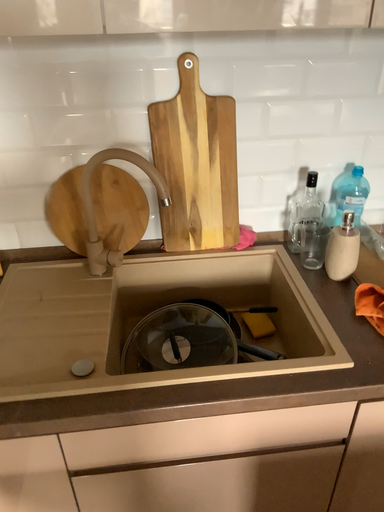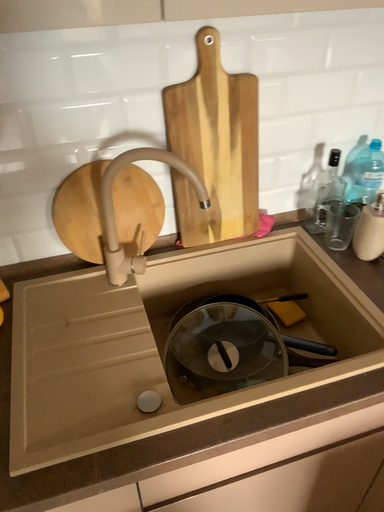
Question: Which way did the camera rotate in the video?

Choices:
 (A) rotated left
 (B) rotated right

Answer: (B)